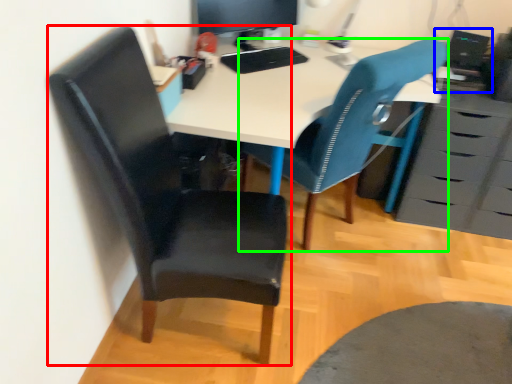
Question: Based on their relative distances, which object is nearer to chair (highlighted by a red box)? Choose from computer (highlighted by a blue box) and chair (highlighted by a green box).

Choices:
 (A) computer
 (B) chair

Answer: (B)